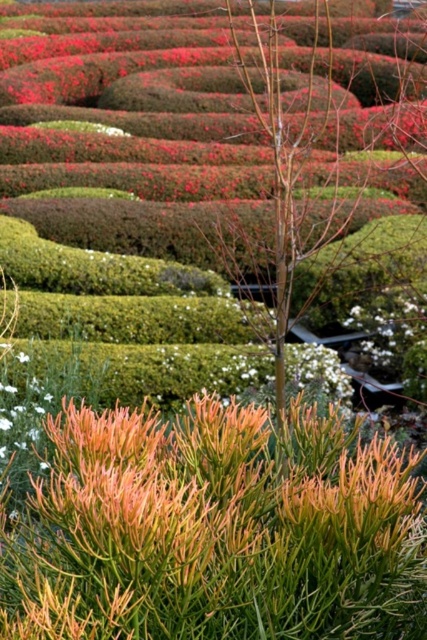
You are a gardener trying to determine which flower is taller between the white matte flower at center and the green matte flower at center. Based on the scene, which one is taller?

The white matte flower at center is taller than the green matte flower at center according to the description.

You are a gardener trying to plant a new flower in the garden. You have two options from the image, the white matte flower at center and the green matte flower at center. If you want to choose the flower with the wider petals, which one should you pick?

The white matte flower at center has a larger width than the green matte flower at center, so you should pick the white matte flower at center.

You are designing a garden layout and want to place a new statue between the white matte flower at center and the green matte flower at center. Based on their positions, which flower should the statue be closer to if you want it to be equidistant from both?

The statue should be placed exactly between the white matte flower at center and the green matte flower at center since they are positioned side by side with the white one to the right of the green one.